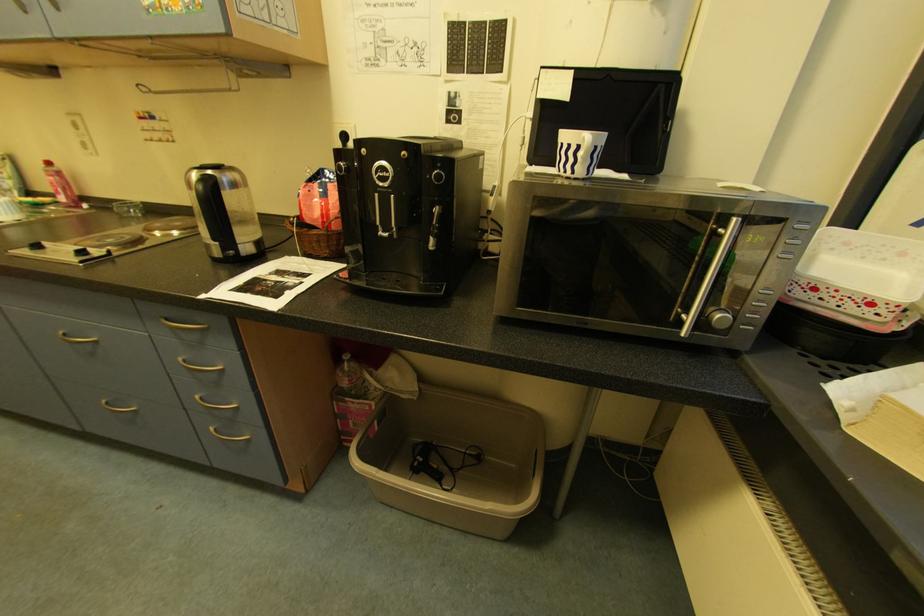
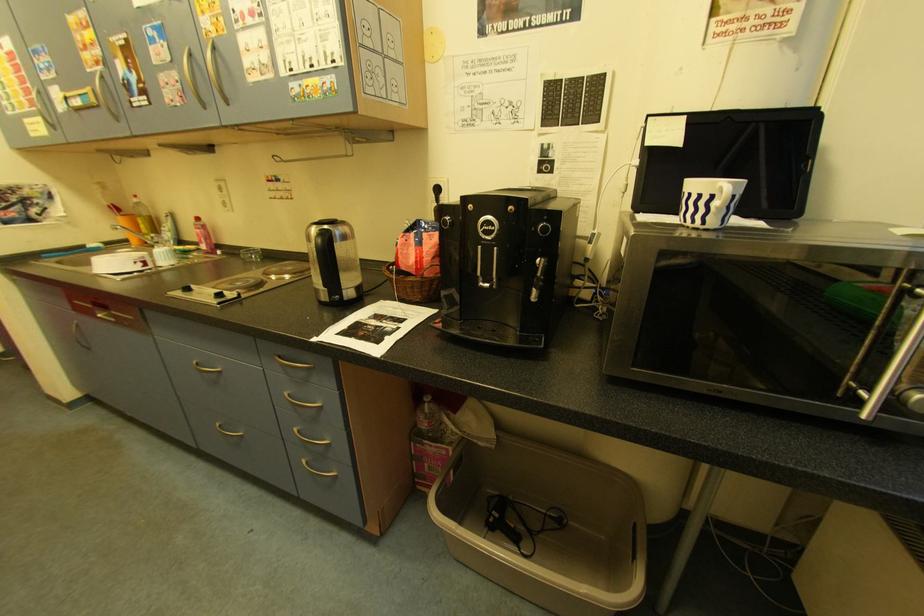
Question: Based on the continuous images, in which direction is the camera rotating? Reply with the corresponding letter.

Choices:
 (A) Left
 (B) Right
 (C) Up
 (D) Down

Answer: (A)